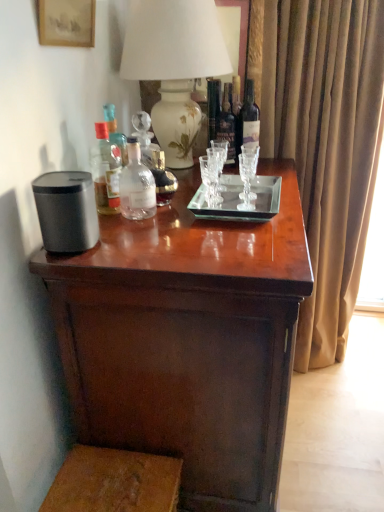
You are a GUI agent. You are given a task and a screenshot of the screen. Output one action in this format:
    pyautogui.click(x=<x>, y=<y>)
    Task: Click on the blank space situated above dark wood table at center (from a real-world perspective)
    
    Given the screenshot: What is the action you would take?
    pyautogui.click(x=200, y=215)